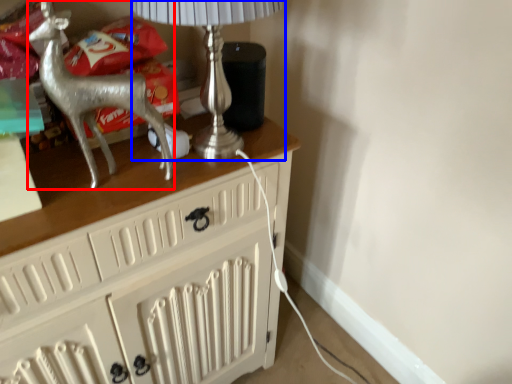
Question: Which object is further to the camera taking this photo, reindeer (highlighted by a red box) or table lamp (highlighted by a blue box)?

Choices:
 (A) reindeer
 (B) table lamp

Answer: (B)